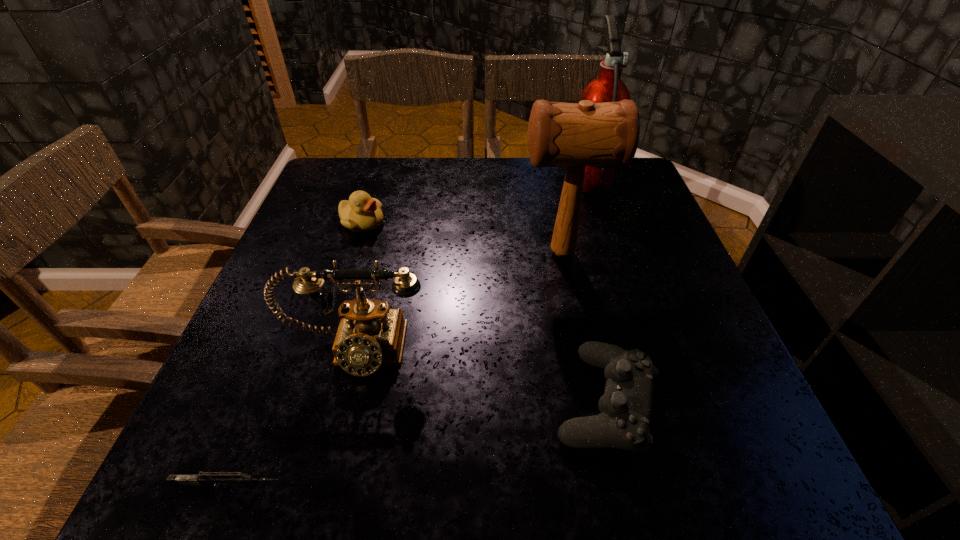
Locate an element on the screen. Image resolution: width=960 pixels, height=540 pixels. vacant space at the left edge of the desktop is located at coordinates (337, 228).

Find the location of `free space at the right edge of the desktop`. free space at the right edge of the desktop is located at coordinates (656, 252).

At what (x,y) coordinates should I click in order to perform the action: click on free space at the far left corner of the desktop. Please return your answer as a coordinate pair (x, y). Image resolution: width=960 pixels, height=540 pixels. Looking at the image, I should click on (360, 179).

In the image, there is a desktop. Where is `vacant area at the far right corner`? vacant area at the far right corner is located at coordinates (642, 187).

Find the location of a particular element. The height and width of the screenshot is (540, 960). vacant point located between the duckling and the control is located at coordinates (484, 312).

The image size is (960, 540). Find the location of `unoccupied area between the control and the duckling`. unoccupied area between the control and the duckling is located at coordinates (484, 312).

You are a GUI agent. You are given a task and a screenshot of the screen. Output one action in this format:
    pyautogui.click(x=<x>, y=<y>)
    Task: Click on the blank region between the second shortest object and the mallet
    The image size is (960, 540).
    Given the screenshot: What is the action you would take?
    pyautogui.click(x=584, y=327)

In order to click on vacant area between the shortest object and the fifth tallest object in this screenshot , I will do `click(418, 444)`.

This screenshot has width=960, height=540. Find the location of `free point between the mallet and the telephone`. free point between the mallet and the telephone is located at coordinates (458, 301).

The height and width of the screenshot is (540, 960). I want to click on free space between the duckling and the control, so click(x=484, y=312).